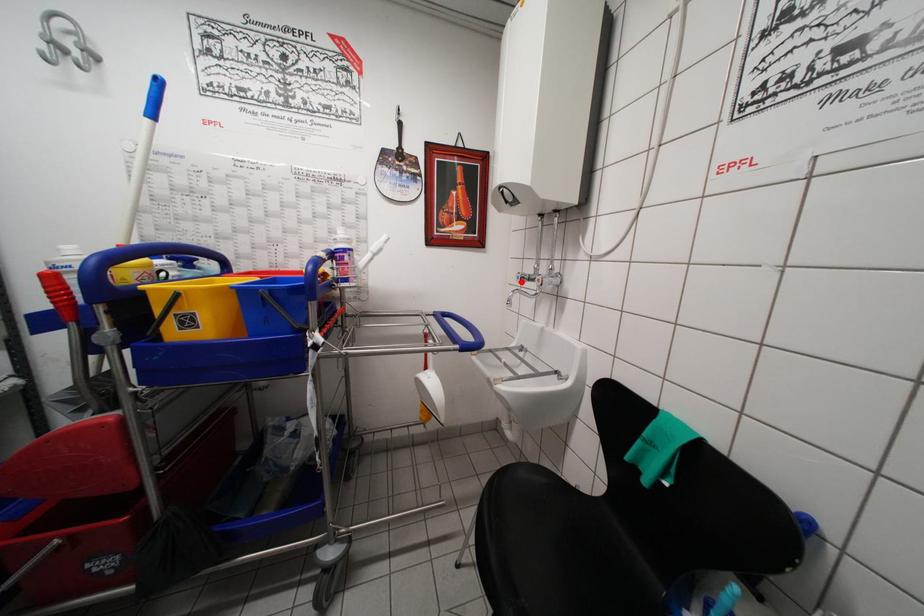
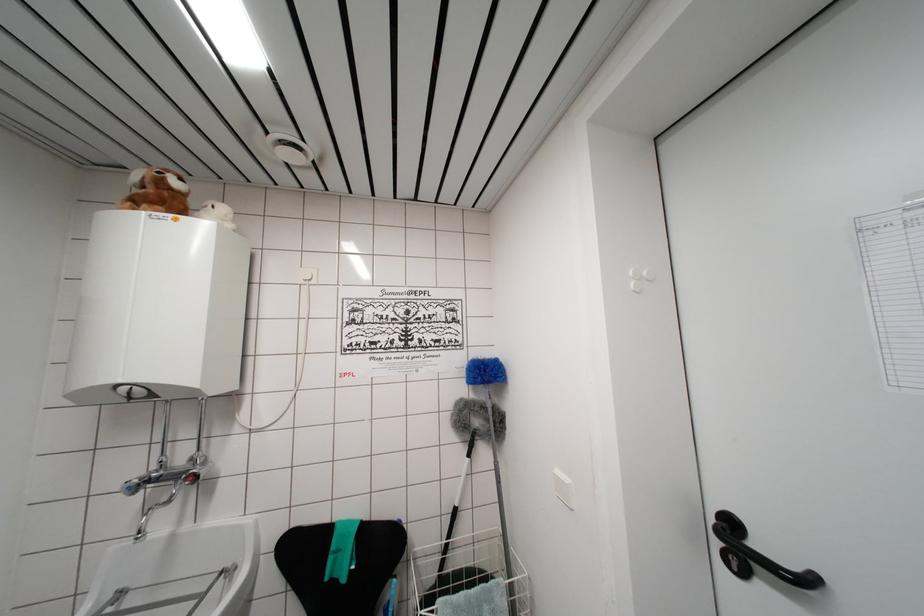
Where in the second image is the point corresponding to the highlighted location from the first image?

(132, 493)